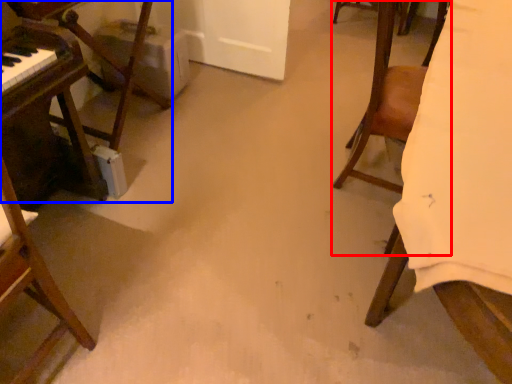
Question: Which point is further to the camera, chair (highlighted by a red box) or furniture (highlighted by a blue box)?

Choices:
 (A) chair
 (B) furniture

Answer: (B)